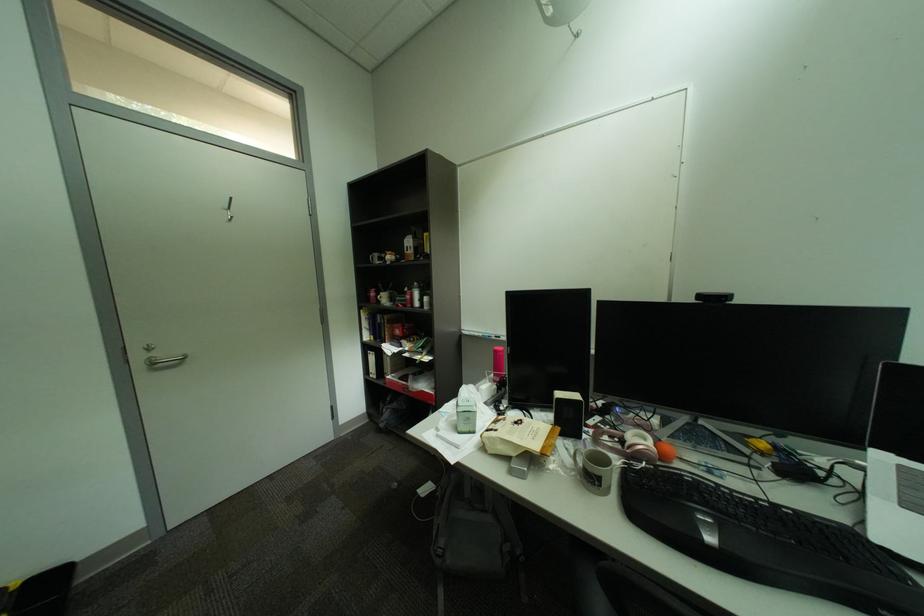
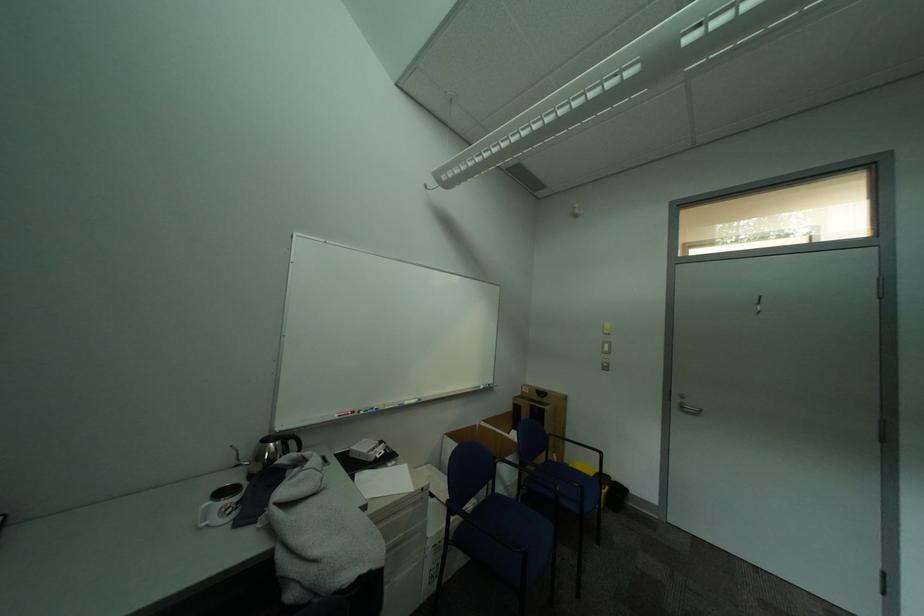
Question: How did the camera likely rotate?

Choices:
 (A) Left
 (B) Right
 (C) Up
 (D) Down

Answer: (A)